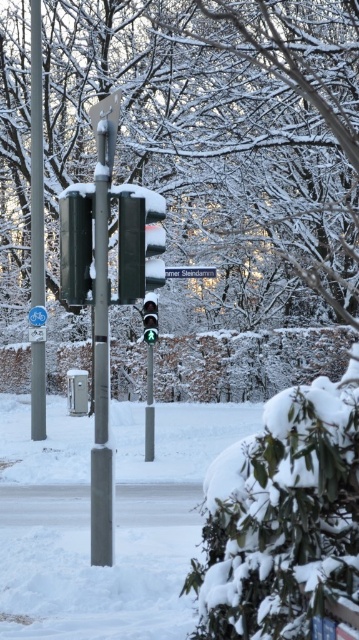
Question: Is metallic gray pole at center below green glass traffic light at center?

Choices:
 (A) yes
 (B) no

Answer: (B)

Question: Does white plastic street sign at center appear on the left side of blue plastic bicycle at center?

Choices:
 (A) yes
 (B) no

Answer: (B)

Question: Among these points, which one is nearest to the camera?

Choices:
 (A) (152, 307)
 (B) (132, 228)
 (C) (31, 161)
 (D) (95, 346)

Answer: (D)

Question: Which object is the closest to the blue plastic bicycle at center?

Choices:
 (A) green matte traffic light at center
 (B) green glass traffic light at center
 (C) metallic gray pole at center
 (D) smooth metallic pole at left

Answer: (D)

Question: Which of these objects is positioned farthest from the green glass traffic light at center?

Choices:
 (A) green matte traffic light at center
 (B) smooth metallic pole at left
 (C) blue plastic bicycle at center
 (D) white plastic street sign at center

Answer: (A)

Question: Is smooth metallic pole at left behind white plastic street sign at center?

Choices:
 (A) yes
 (B) no

Answer: (A)